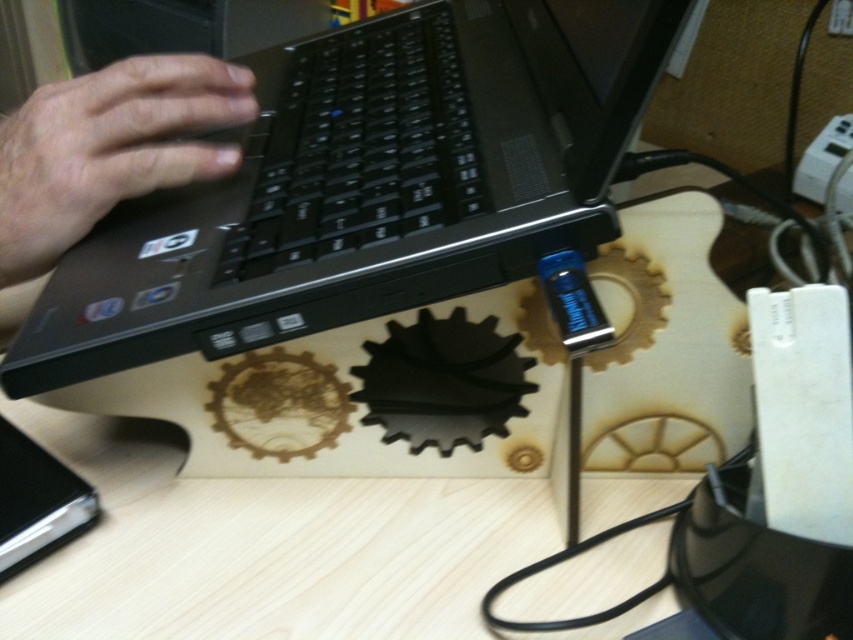
Question: Among these objects, which one is farthest from the camera?

Choices:
 (A) black matte keyboard at center
 (B) black plastic laptop at center

Answer: (A)

Question: Does black matte keyboard at center lie behind skinny white hand at left?

Choices:
 (A) yes
 (B) no

Answer: (B)

Question: Which object appears farthest from the camera in this image?

Choices:
 (A) black matte keyboard at center
 (B) skinny white hand at left
 (C) black plastic laptop at center

Answer: (B)

Question: Is black plastic laptop at center smaller than skinny white hand at left?

Choices:
 (A) no
 (B) yes

Answer: (A)

Question: Is black plastic laptop at center to the left of skinny white hand at left from the viewer's perspective?

Choices:
 (A) yes
 (B) no

Answer: (B)

Question: Based on their relative distances, which object is farther from the skinny white hand at left?

Choices:
 (A) black plastic laptop at center
 (B) black matte keyboard at center

Answer: (A)